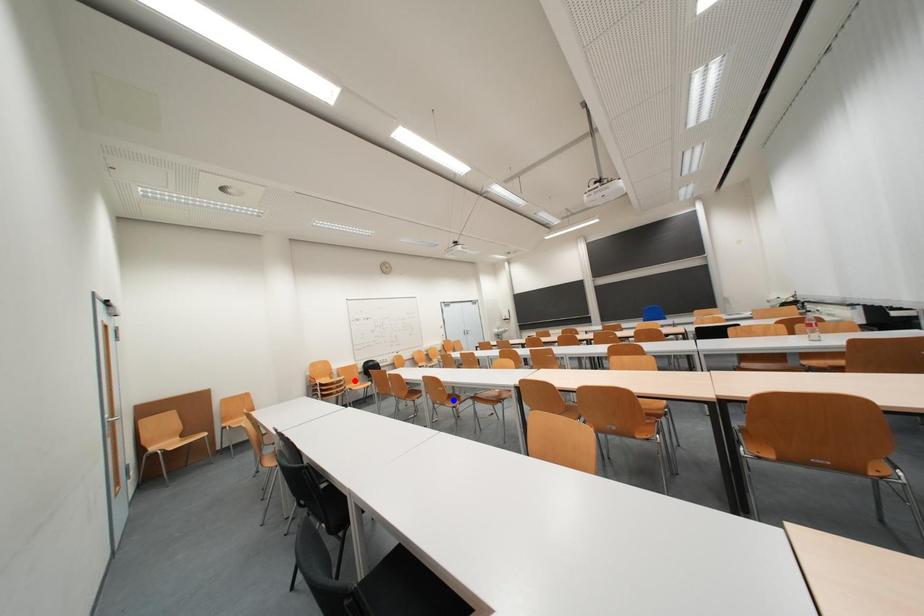
Question: Which of the two points in the image is closer to the camera?

Choices:
 (A) Blue point is closer.
 (B) Red point is closer.

Answer: (A)